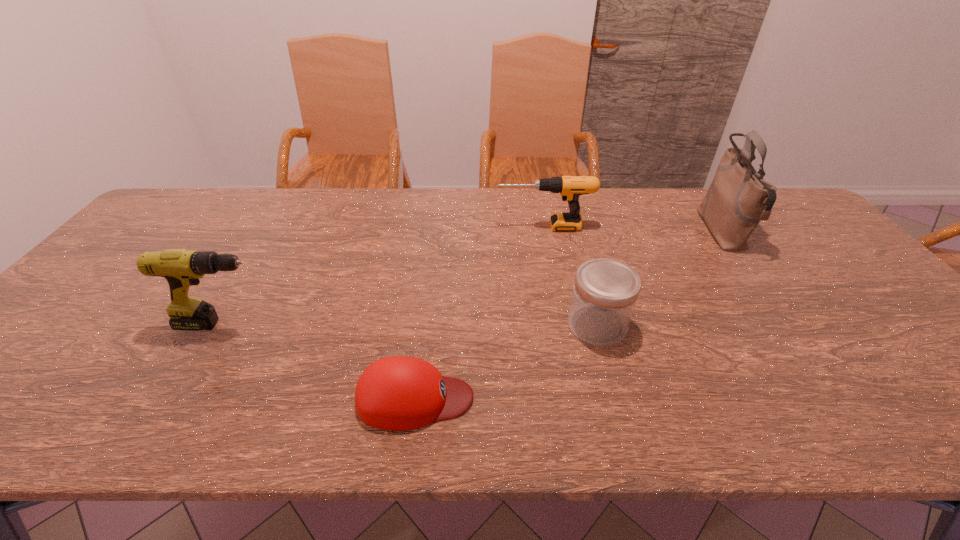
This screenshot has height=540, width=960. What are the coordinates of `free space between the nearest object and the left drill` in the screenshot? It's located at (320, 361).

This screenshot has width=960, height=540. I want to click on unoccupied position between the leftmost object and the nearest object, so click(320, 361).

Identify the location of free space that is in between the rightmost object and the second tallest object. The width and height of the screenshot is (960, 540). (473, 278).

Find the location of `unoccupied area between the taller drill and the rightmost object`. unoccupied area between the taller drill and the rightmost object is located at coordinates (473, 278).

Locate which object ranks fourth in proximity to the tallest object. Please provide its 2D coordinates. Your answer should be formatted as a tuple, i.e. [(x, y)], where the tuple contains the x and y coordinates of a point satisfying the conditions above.

[(182, 268)]

Locate which object ranks second in proximity to the taller drill. Please provide its 2D coordinates. Your answer should be formatted as a tuple, i.e. [(x, y)], where the tuple contains the x and y coordinates of a point satisfying the conditions above.

[(570, 188)]

This screenshot has width=960, height=540. I want to click on vacant space that satisfies the following two spatial constraints: 1. on the handle side of the jar; 2. on the right side of the nearer drill, so click(224, 325).

At what (x,y) coordinates should I click in order to perform the action: click on vacant space that satisfies the following two spatial constraints: 1. on the back side of the jar; 2. on the handle side of the leftmost object. Please return your answer as a coordinate pair (x, y). The width and height of the screenshot is (960, 540). Looking at the image, I should click on (597, 324).

Locate an element on the screen. free space that satisfies the following two spatial constraints: 1. on the handle side of the jar; 2. on the left side of the second tallest object is located at coordinates (224, 325).

You are a GUI agent. You are given a task and a screenshot of the screen. Output one action in this format:
    pyautogui.click(x=<x>, y=<y>)
    Task: Click on the vacant space that satisfies the following two spatial constraints: 1. on the handle side of the jar; 2. on the right side of the taller drill
    The image size is (960, 540).
    Given the screenshot: What is the action you would take?
    pyautogui.click(x=224, y=325)